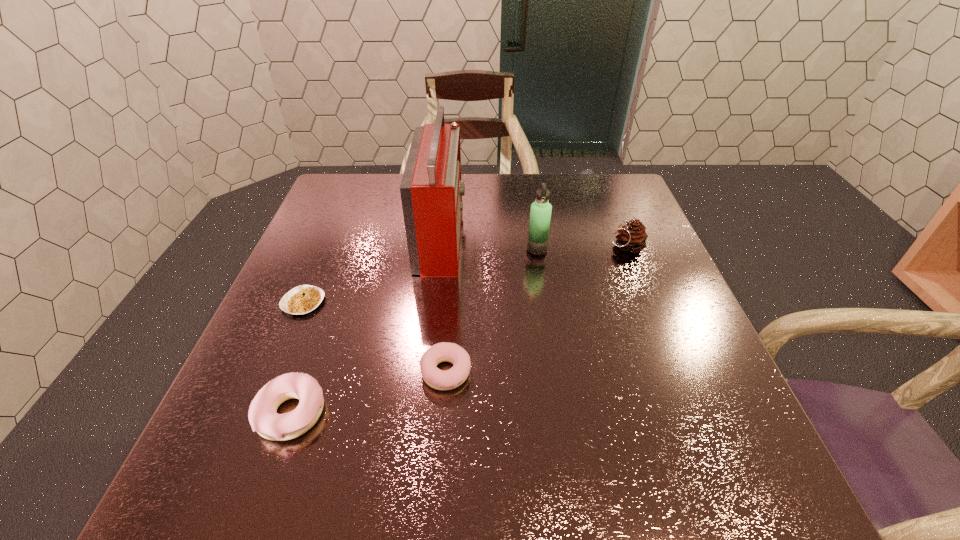
This screenshot has width=960, height=540. Identify the location of doughnut that is positioned at the left edge. pyautogui.click(x=263, y=417).

Identify the location of legume positioned at the left edge. This screenshot has height=540, width=960. (302, 299).

This screenshot has width=960, height=540. Find the location of `object positioned at the right edge`. object positioned at the right edge is located at coordinates (632, 237).

Where is `object present at the near left corner`? This screenshot has height=540, width=960. object present at the near left corner is located at coordinates (263, 417).

At what (x,y) coordinates should I click in order to perform the action: click on vacant region at the far edge. Please return your answer as a coordinate pair (x, y). Looking at the image, I should click on (490, 207).

Image resolution: width=960 pixels, height=540 pixels. What are the coordinates of `free location at the left edge of the desktop` in the screenshot? It's located at (348, 294).

This screenshot has width=960, height=540. Identify the location of vacant space at the right edge. [692, 355].

This screenshot has height=540, width=960. In the image, there is a desktop. In order to click on vacant space at the far left corner in this screenshot , I will do `click(363, 192)`.

In order to click on vacant area at the far right corner in this screenshot , I will do `click(618, 180)`.

Locate an element on the screen. The height and width of the screenshot is (540, 960). vacant space at the near right corner is located at coordinates (725, 427).